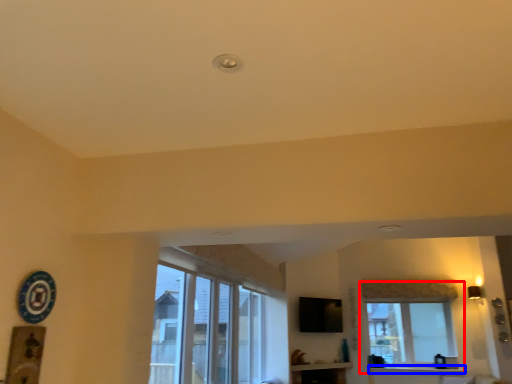
Question: Which of the following is the closest to the observer, window (highlighted by a red box) or window sill (highlighted by a blue box)?

Choices:
 (A) window
 (B) window sill

Answer: (B)